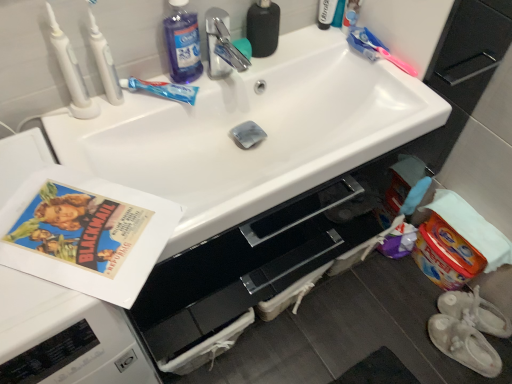
Find the location of a particular element. Image resolution: width=512 pixels, height=384 pixels. vacant space that is in between white plastic tube at upper right and black matte bottle at upper center is located at coordinates (300, 39).